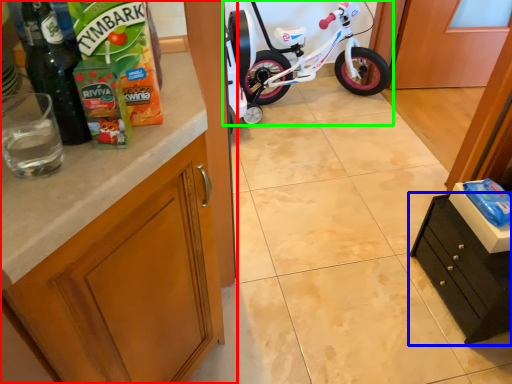
Question: Estimate the real-world distances between objects in this image. Which object is farther from cabinetry (highlighted by a red box), cabinetry (highlighted by a blue box) or bicycle (highlighted by a green box)?

Choices:
 (A) cabinetry
 (B) bicycle

Answer: (B)